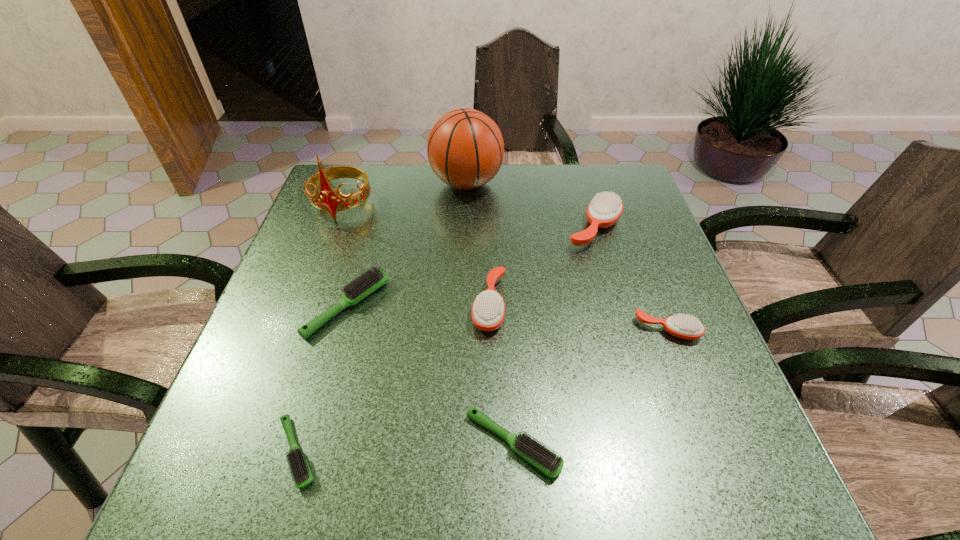
Where is `basketball`? This screenshot has width=960, height=540. basketball is located at coordinates (465, 148).

The width and height of the screenshot is (960, 540). In order to click on red tiara in this screenshot , I will do `click(327, 199)`.

This screenshot has height=540, width=960. I want to click on the farthest orange hairbrush, so pyautogui.click(x=605, y=209).

You are a GUI agent. You are given a task and a screenshot of the screen. Output one action in this format:
    pyautogui.click(x=<x>, y=<y>)
    Task: Click on the farthest hairbrush
    This screenshot has height=540, width=960.
    Given the screenshot: What is the action you would take?
    pyautogui.click(x=605, y=209)

You are a GUI agent. You are given a task and a screenshot of the screen. Output one action in this format:
    pyautogui.click(x=<x>, y=<y>)
    Task: Click on the second biggest orange hairbrush
    
    Given the screenshot: What is the action you would take?
    pyautogui.click(x=488, y=310)

Identify the location of the leftmost orange hairbrush. This screenshot has height=540, width=960. (488, 310).

Locate an element on the screen. This screenshot has width=960, height=540. the biggest light hairbrush is located at coordinates (362, 286).

Identify the location of the smallest orange hairbrush. Image resolution: width=960 pixels, height=540 pixels. (685, 326).

I want to click on the rightmost light hairbrush, so click(538, 455).

In order to click on the second shortest hairbrush in this screenshot , I will do `click(538, 455)`.